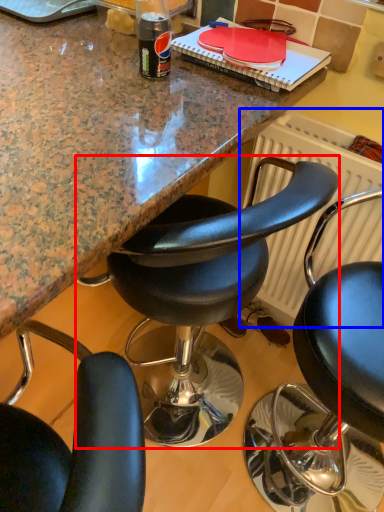
Question: Which point is closer to the camera, chair (highlighted by a red box) or radiator (highlighted by a blue box)?

Choices:
 (A) chair
 (B) radiator

Answer: (A)